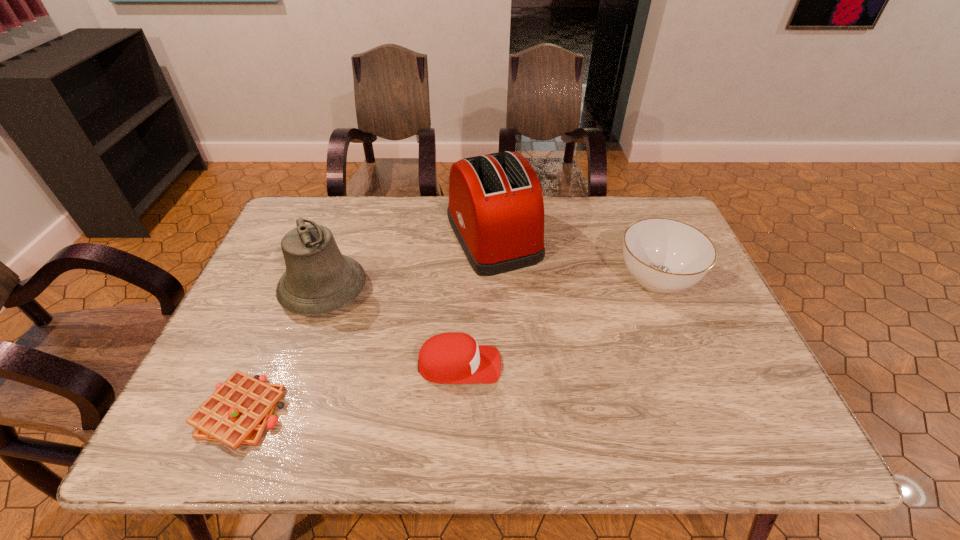
What are the coordinates of `free space between the baseball cap and the waffle` in the screenshot? It's located at (350, 389).

Find the location of a particular element. The image size is (960, 540). vacant space in between the toaster and the baseball cap is located at coordinates (476, 301).

You are a GUI agent. You are given a task and a screenshot of the screen. Output one action in this format:
    pyautogui.click(x=<x>, y=<y>)
    Task: Click on the object that stands as the closest to the second shortest object
    
    Given the screenshot: What is the action you would take?
    pyautogui.click(x=318, y=279)

Identify which object is located as the fourth nearest to the chinaware. Please provide its 2D coordinates. Your answer should be formatted as a tuple, i.e. [(x, y)], where the tuple contains the x and y coordinates of a point satisfying the conditions above.

[(238, 412)]

At what (x,y) coordinates should I click in order to perform the action: click on vacant region that satisfies the following two spatial constraints: 1. on the front side of the chinaware; 2. on the front-facing side of the baseball cap. Please return your answer as a coordinate pair (x, y). This screenshot has width=960, height=540. Looking at the image, I should click on (691, 365).

Locate an element on the screen. The height and width of the screenshot is (540, 960). vacant space that satisfies the following two spatial constraints: 1. on the back side of the toaster; 2. on the left side of the shortest object is located at coordinates (316, 237).

Find the location of a particular element. free spot that satisfies the following two spatial constraints: 1. on the back side of the third tallest object; 2. on the right side of the bell is located at coordinates (328, 280).